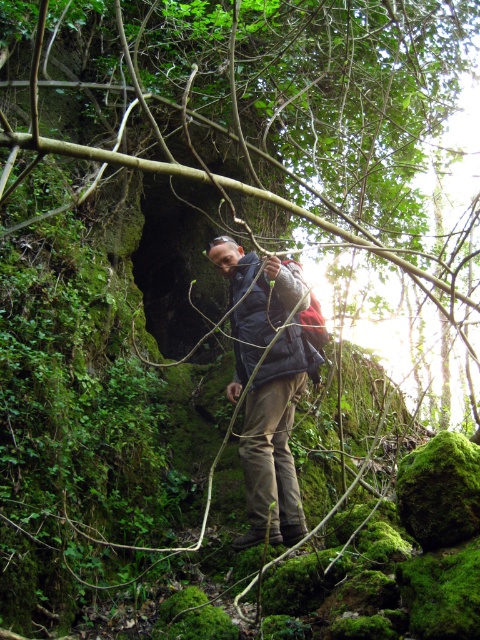
Question: Does green mossy rock at center appear on the left side of dark blue jacket at center?

Choices:
 (A) yes
 (B) no

Answer: (A)

Question: Does green mossy rock at center have a greater width compared to dark blue fabric jacket at center?

Choices:
 (A) no
 (B) yes

Answer: (B)

Question: Which object appears closest to the camera in this image?

Choices:
 (A) dark blue jacket at center
 (B) green mossy rock at center
 (C) dark blue fabric jacket at center

Answer: (B)

Question: Which point appears farthest from the camera in this image?

Choices:
 (A) (263, 310)
 (B) (308, 92)
 (C) (320, 358)

Answer: (B)

Question: Is dark blue jacket at center positioned at the back of dark blue fabric jacket at center?

Choices:
 (A) no
 (B) yes

Answer: (A)

Question: Among these points, which one is nearest to the camera?

Choices:
 (A) (265, 305)
 (B) (274, 1)
 (C) (251, 540)

Answer: (B)